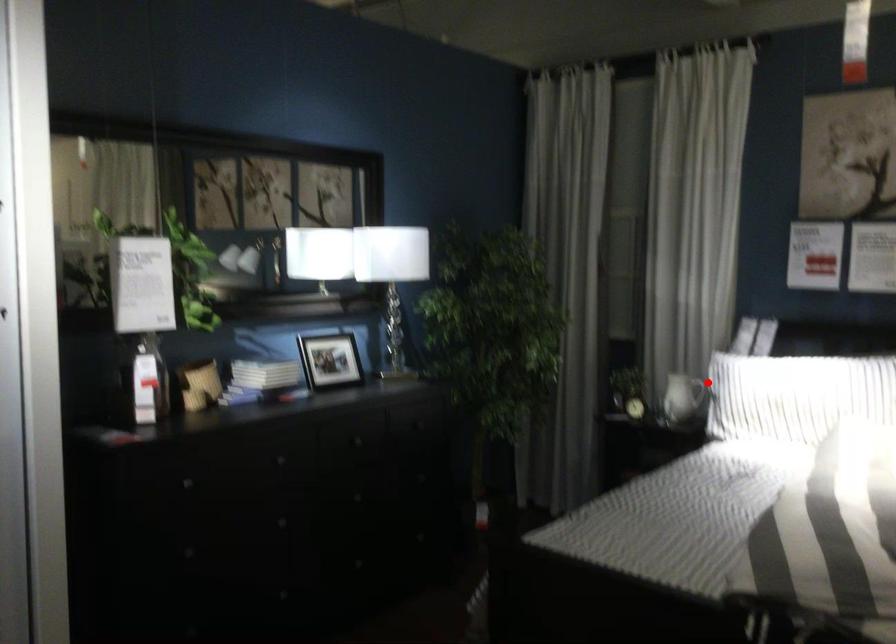
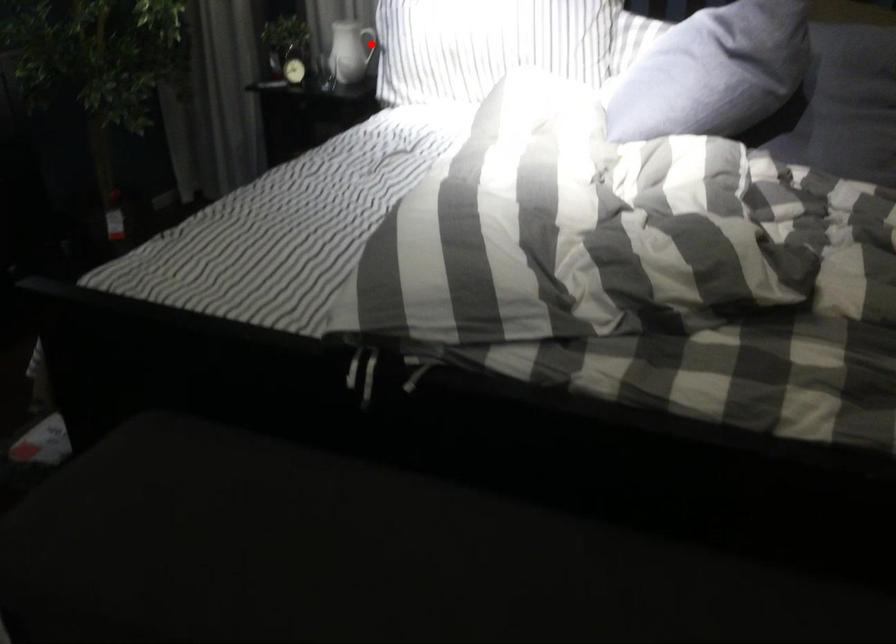
I am providing you with two images of the same scene from different viewpoints. A red point is marked on the first image and another point is marked on the second image. Is the marked point in image1 the same physical position as the marked point in image2?

Yes